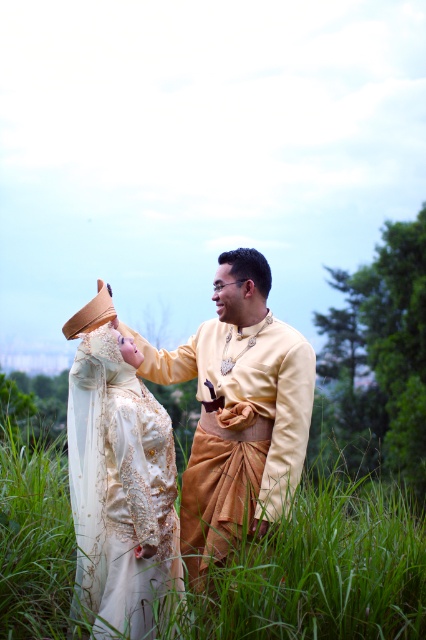
Question: Which point is closer to the camera?

Choices:
 (A) (337, 593)
 (B) (75, 490)

Answer: (A)

Question: Can you confirm if green grass at center is wider than matte gold fabric at center?

Choices:
 (A) no
 (B) yes

Answer: (B)

Question: Which object appears farthest from the camera in this image?

Choices:
 (A) matte gold dress at center
 (B) matte gold fabric at center

Answer: (B)

Question: Estimate the real-world distances between objects in this image. Which object is closer to the matte gold dress at center?

Choices:
 (A) matte gold fabric at center
 (B) green grass at center

Answer: (A)

Question: Does green grass at center have a greater width compared to matte gold dress at center?

Choices:
 (A) no
 (B) yes

Answer: (B)

Question: Is green grass at center below matte gold fabric at center?

Choices:
 (A) no
 (B) yes

Answer: (B)